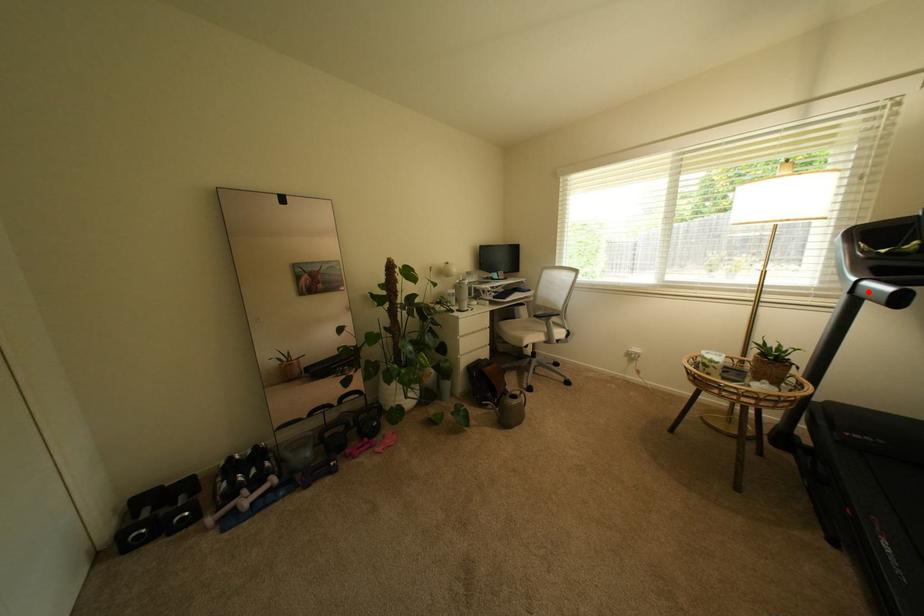
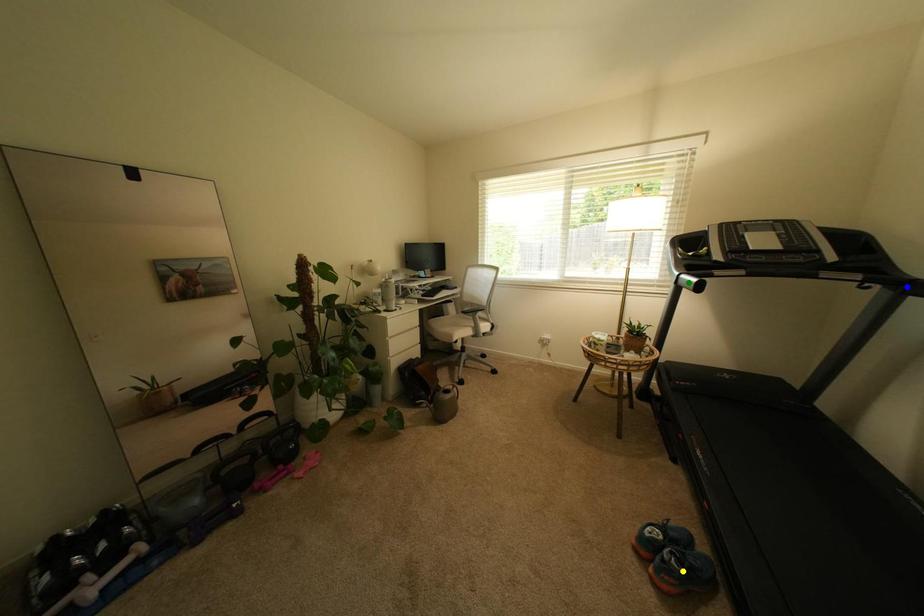
Question: I am providing you with two images of the same scene from different viewpoints. A red point is marked on the first image. You are given multiple points on the second image. Which point in image 2 is actually the same real-world point as the red point in image 1?

Choices:
 (A) green point
 (B) yellow point
 (C) blue point

Answer: (A)